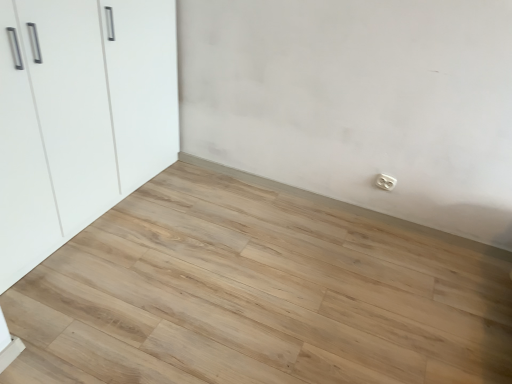
Question: Is the depth of white glossy cupboard at left greater than that of white plastic electric outlet at lower right?

Choices:
 (A) yes
 (B) no

Answer: (B)

Question: From a real-world perspective, is white glossy cupboard at left below white plastic electric outlet at lower right?

Choices:
 (A) yes
 (B) no

Answer: (B)

Question: Is white glossy cupboard at left closer to camera compared to white plastic electric outlet at lower right?

Choices:
 (A) no
 (B) yes

Answer: (B)

Question: Is white glossy cupboard at left wider than white plastic electric outlet at lower right?

Choices:
 (A) no
 (B) yes

Answer: (B)

Question: Is white glossy cupboard at left looking in the opposite direction of white plastic electric outlet at lower right?

Choices:
 (A) no
 (B) yes

Answer: (A)

Question: Is natural wood floor at center bigger or smaller than white glossy cupboard at left?

Choices:
 (A) small
 (B) big

Answer: (A)

Question: Does point click(x=274, y=264) appear closer or farther from the camera than point click(x=56, y=97)?

Choices:
 (A) closer
 (B) farther

Answer: (B)

Question: Is natural wood floor at center spatially inside white glossy cupboard at left, or outside of it?

Choices:
 (A) outside
 (B) inside

Answer: (A)

Question: Looking at their shapes, would you say natural wood floor at center is wider or thinner than white glossy cupboard at left?

Choices:
 (A) wide
 (B) thin

Answer: (A)

Question: Is white plastic electric outlet at lower right bigger or smaller than natural wood floor at center?

Choices:
 (A) small
 (B) big

Answer: (A)

Question: Is white plastic electric outlet at lower right inside or outside of natural wood floor at center?

Choices:
 (A) inside
 (B) outside

Answer: (B)

Question: Considering their positions, is white plastic electric outlet at lower right located in front of or behind natural wood floor at center?

Choices:
 (A) front
 (B) behind

Answer: (B)

Question: In terms of width, does white plastic electric outlet at lower right look wider or thinner when compared to natural wood floor at center?

Choices:
 (A) thin
 (B) wide

Answer: (A)

Question: From the image's perspective, is natural wood floor at center located above or below white plastic electric outlet at lower right?

Choices:
 (A) above
 (B) below

Answer: (B)

Question: Would you say natural wood floor at center is to the left or to the right of white plastic electric outlet at lower right in the picture?

Choices:
 (A) right
 (B) left

Answer: (B)